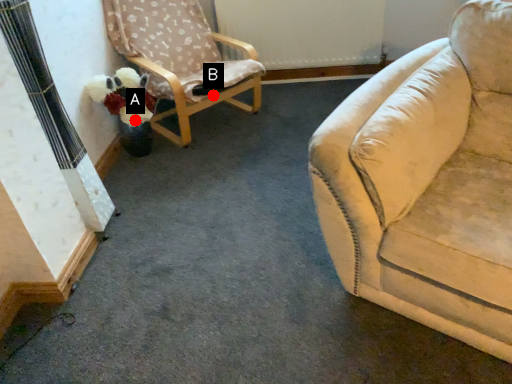
Question: Two points are circled on the image, labeled by A and B beside each circle. Among these points, which one is nearest to the camera?

Choices:
 (A) A is closer
 (B) B is closer

Answer: (A)